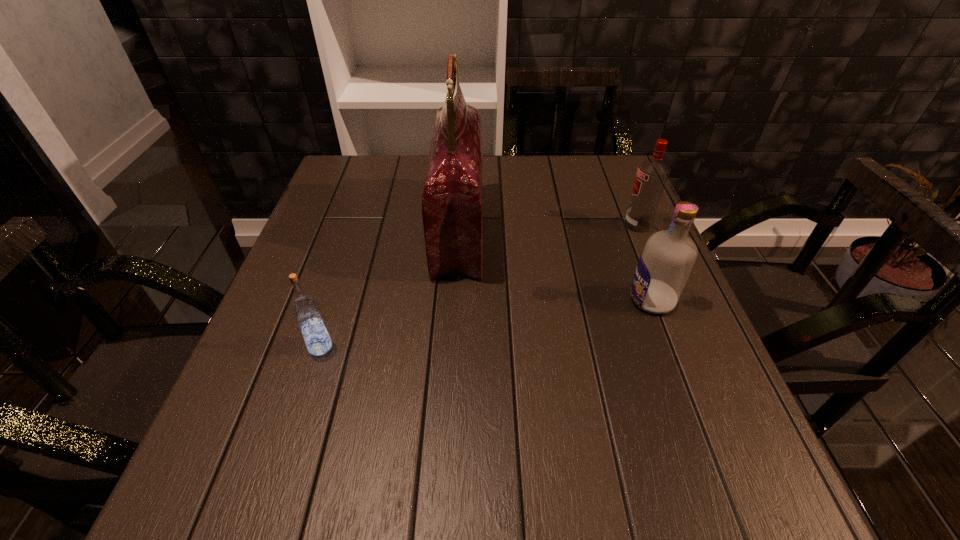
Locate an element on the screen. This screenshot has width=960, height=540. the second object from left to right is located at coordinates (452, 207).

Where is `the tallest object`? the tallest object is located at coordinates (452, 207).

Identify the location of the second nearest object. (666, 261).

You are a GUI agent. You are given a task and a screenshot of the screen. Output one action in this format:
    pyautogui.click(x=<x>, y=<y>)
    Task: Click on the farthest vodka
    
    Given the screenshot: What is the action you would take?
    pyautogui.click(x=652, y=174)

Locate an element on the screen. the leftmost object is located at coordinates (305, 309).

Locate an element on the screen. the nearest object is located at coordinates (305, 309).

Find the location of a particular element. vacant region located 0.110m on the front-facing side of the handbag is located at coordinates (528, 230).

The height and width of the screenshot is (540, 960). Find the location of `free space located on the label of the second farthest vodka`. free space located on the label of the second farthest vodka is located at coordinates (512, 300).

The height and width of the screenshot is (540, 960). What are the coordinates of `vacant space located on the label of the second farthest vodka` in the screenshot? It's located at (580, 300).

You are a GUI agent. You are given a task and a screenshot of the screen. Output one action in this format:
    pyautogui.click(x=<x>, y=<y>)
    Task: Click on the vacant space located 0.220m on the label of the second farthest vodka
    
    Given the screenshot: What is the action you would take?
    pyautogui.click(x=521, y=300)